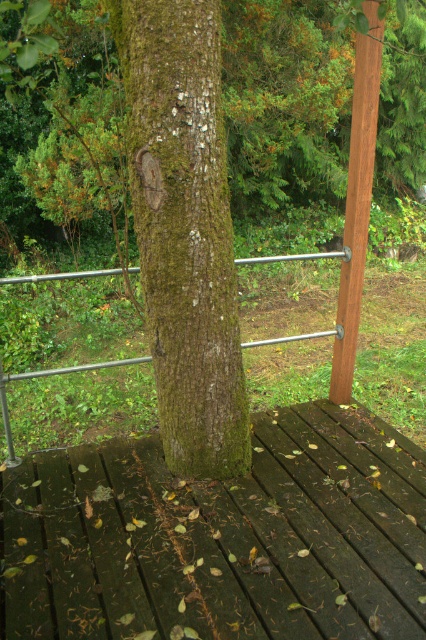
You are standing on the wooden deck surrounded by greenery and looking at the green mossy bark tree at center and the green rough bark tree trunk at center. Which one appears closer to you?

The green mossy bark tree at center appears closer because the green rough bark tree trunk at center is positioned behind it.